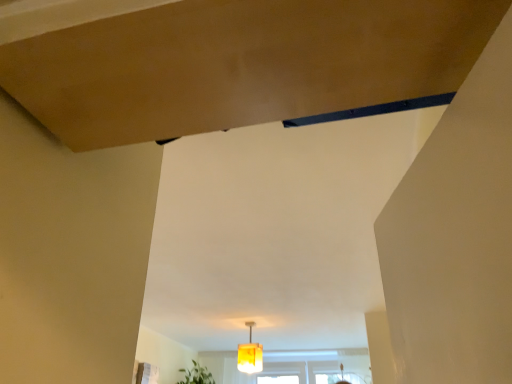
Measure the distance between translucent yellow lampshade at center and camera.

translucent yellow lampshade at center is 12.55 feet away from camera.

The height and width of the screenshot is (384, 512). Describe the element at coordinates (250, 354) in the screenshot. I see `translucent yellow lampshade at center` at that location.

At what (x,y) coordinates should I click in order to perform the action: click on translucent yellow lampshade at center. Please return your answer as a coordinate pair (x, y). The width and height of the screenshot is (512, 384). Looking at the image, I should click on (250, 354).

Find the location of a particular element. The height and width of the screenshot is (384, 512). green leafy plant at lower center is located at coordinates (196, 375).

Describe the element at coordinates (196, 375) in the screenshot. The image size is (512, 384). I see `green leafy plant at lower center` at that location.

The height and width of the screenshot is (384, 512). In order to click on translucent yellow lampshade at center in this screenshot , I will do `click(250, 354)`.

Considering the positions of objects green leafy plant at lower center and translucent yellow lampshade at center in the image provided, who is more to the right, green leafy plant at lower center or translucent yellow lampshade at center?

From the viewer's perspective, translucent yellow lampshade at center appears more on the right side.

Is green leafy plant at lower center positioned before translucent yellow lampshade at center?

No, the depth of green leafy plant at lower center is greater than that of translucent yellow lampshade at center.

Considering the points (199, 367) and (247, 349), which point is in front, point (199, 367) or point (247, 349)?

The point (247, 349) is closer to the camera.

From the image's perspective, is green leafy plant at lower center located above or below translucent yellow lampshade at center?

Based on their image positions, green leafy plant at lower center is located beneath translucent yellow lampshade at center.

From a real-world perspective, is green leafy plant at lower center on translucent yellow lampshade at center?

No, from a real-world perspective, green leafy plant at lower center is not on top of translucent yellow lampshade at center.

Can you confirm if green leafy plant at lower center is wider than translucent yellow lampshade at center?

Indeed, green leafy plant at lower center has a greater width compared to translucent yellow lampshade at center.

Between green leafy plant at lower center and translucent yellow lampshade at center, which one has more height?

translucent yellow lampshade at center is taller.

Is green leafy plant at lower center bigger than translucent yellow lampshade at center?

Indeed, green leafy plant at lower center has a larger size compared to translucent yellow lampshade at center.

Is green leafy plant at lower center spatially inside translucent yellow lampshade at center, or outside of it?

green leafy plant at lower center exists outside the volume of translucent yellow lampshade at center.

Based on the photo, is green leafy plant at lower center next to translucent yellow lampshade at center and touching it?

No, green leafy plant at lower center is not making contact with translucent yellow lampshade at center.

Is green leafy plant at lower center facing away from translucent yellow lampshade at center?

No, green leafy plant at lower center's orientation is not away from translucent yellow lampshade at center.

How different are the orientations of green leafy plant at lower center and translucent yellow lampshade at center in degrees?

103 degrees separate the facing orientations of green leafy plant at lower center and translucent yellow lampshade at center.

This screenshot has height=384, width=512. I want to click on lamp above the green leafy plant at lower center (from the image's perspective), so click(x=250, y=354).

Looking at this image, based on their positions, is translucent yellow lampshade at center located to the left or right of green leafy plant at lower center?

From the image, it's evident that translucent yellow lampshade at center is to the right of green leafy plant at lower center.

Looking at this image, is the depth of translucent yellow lampshade at center less than that of green leafy plant at lower center?

Yes.

Between point (242, 368) and point (186, 372), which one is positioned behind?

The point (186, 372) is behind.

From the image's perspective, is translucent yellow lampshade at center positioned above or below green leafy plant at lower center?

translucent yellow lampshade at center is situated higher than green leafy plant at lower center in the image.

From a real-world perspective, is translucent yellow lampshade at center physically below green leafy plant at lower center?

Incorrect, from a real-world perspective, translucent yellow lampshade at center is higher than green leafy plant at lower center.

Looking at their sizes, would you say translucent yellow lampshade at center is wider or thinner than green leafy plant at lower center?

Clearly, translucent yellow lampshade at center has less width compared to green leafy plant at lower center.

Considering the sizes of objects translucent yellow lampshade at center and green leafy plant at lower center in the image provided, who is shorter, translucent yellow lampshade at center or green leafy plant at lower center?

green leafy plant at lower center is shorter.

Is translucent yellow lampshade at center bigger or smaller than green leafy plant at lower center?

translucent yellow lampshade at center is smaller than green leafy plant at lower center.

Could green leafy plant at lower center be considered to be inside translucent yellow lampshade at center?

Definitely not — green leafy plant at lower center is not inside translucent yellow lampshade at center.

Is there a large distance between translucent yellow lampshade at center and green leafy plant at lower center?

Absolutely, translucent yellow lampshade at center is distant from green leafy plant at lower center.

Is translucent yellow lampshade at center oriented towards green leafy plant at lower center?

No, translucent yellow lampshade at center is not aimed at green leafy plant at lower center.

How many degrees apart are the facing directions of translucent yellow lampshade at center and green leafy plant at lower center?

There is a 103-degree angle between the facing directions of translucent yellow lampshade at center and green leafy plant at lower center.

This screenshot has width=512, height=384. I want to click on lamp above the green leafy plant at lower center (from a real-world perspective), so click(x=250, y=354).

What are the coordinates of `lamp that appears above the green leafy plant at lower center (from the image's perspective)` in the screenshot? It's located at [250, 354].

Find the location of a particular element. The height and width of the screenshot is (384, 512). plant below the translucent yellow lampshade at center (from a real-world perspective) is located at coordinates (196, 375).